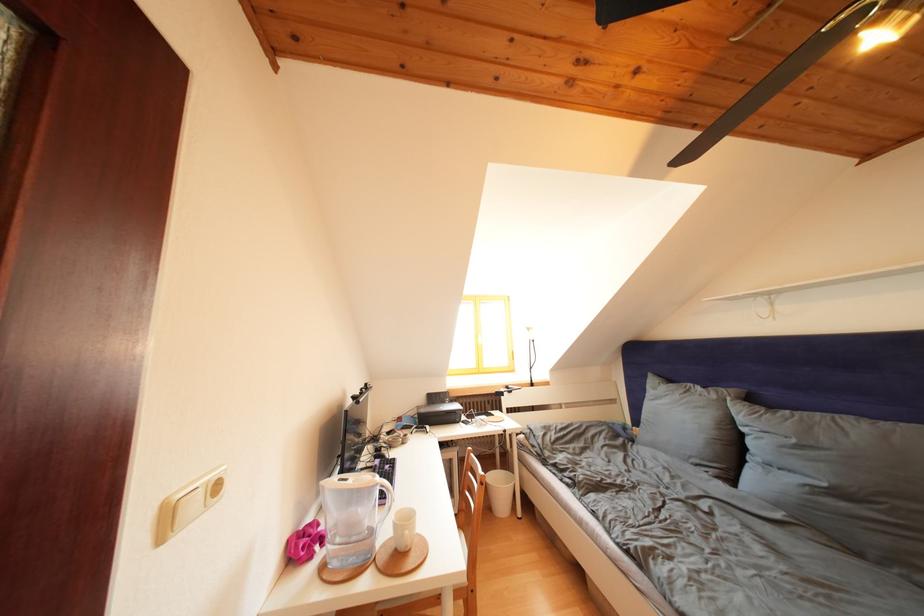
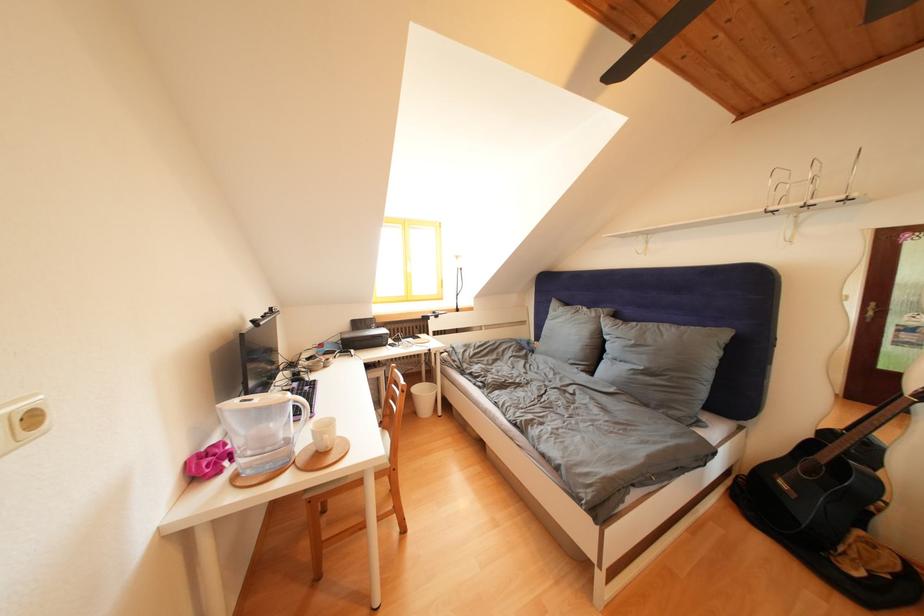
Question: The images are taken continuously from a first-person perspective. In which direction are you moving?

Choices:
 (A) Left
 (B) Right
 (C) Forward
 (D) Backward

Answer: (B)